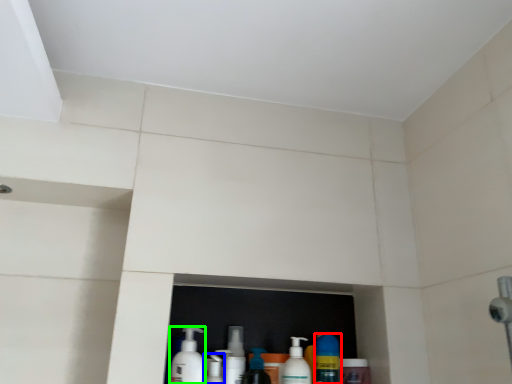
Question: Which object is the closest to the cleaning product (highlighted by a red box)? Choose among these: cleaning product (highlighted by a blue box) or cleaning product (highlighted by a green box).

Choices:
 (A) cleaning product
 (B) cleaning product

Answer: (A)